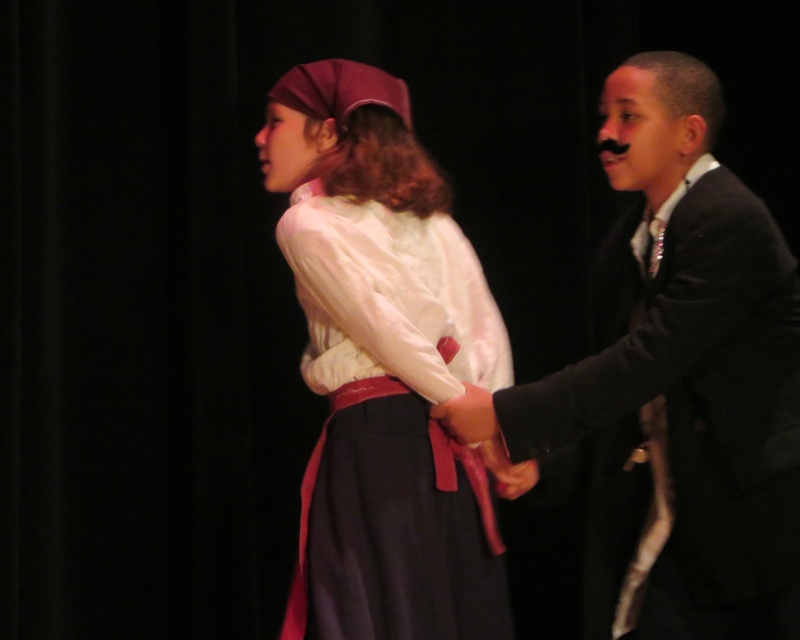
Question: Which point is farther from the camera taking this photo?

Choices:
 (A) (468, 444)
 (B) (438, 480)
 (C) (612, 131)

Answer: (C)

Question: Where is black satin suit at right located in relation to matte white blouse at center in the image?

Choices:
 (A) above
 (B) below

Answer: (B)

Question: Which point is closer to the camera taking this photo?

Choices:
 (A) (692, 291)
 (B) (474, 403)
 (C) (358, 172)

Answer: (A)

Question: Does matte white blouse at center appear on the right side of smooth leather hand at center?

Choices:
 (A) no
 (B) yes

Answer: (A)

Question: Can you confirm if black satin suit at right is positioned to the right of matte white blouse at center?

Choices:
 (A) no
 (B) yes

Answer: (B)

Question: Based on their relative distances, which object is farther from the matte white blouse at center?

Choices:
 (A) smooth leather hand at center
 (B) black satin suit at right

Answer: (B)